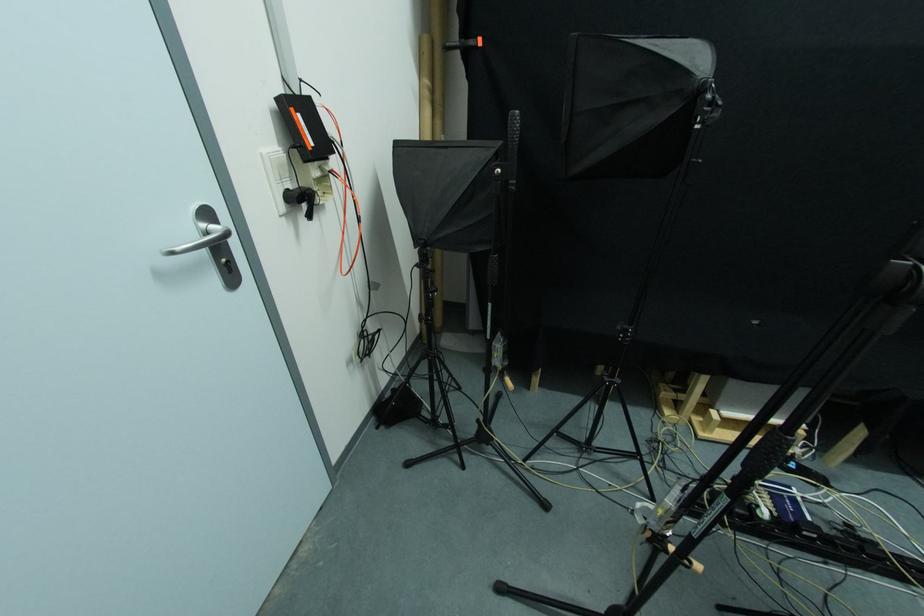
What do you see at coordinates (530, 147) in the screenshot? Image resolution: width=924 pixels, height=616 pixels. I see `the softbox tilt lever` at bounding box center [530, 147].